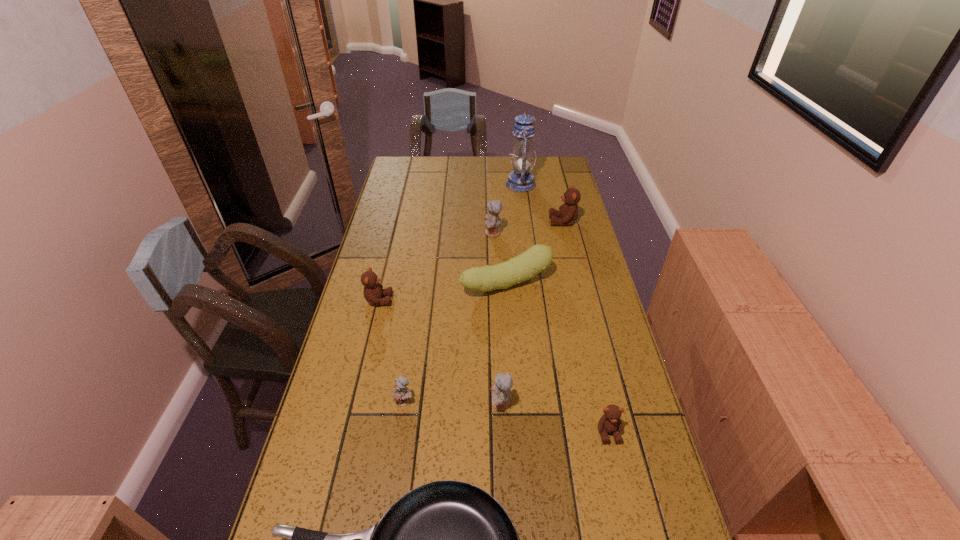
The width and height of the screenshot is (960, 540). I want to click on free location located on the face of the farthest brown teddy bear, so click(519, 221).

Where is `free space located 0.390m on the front of the cucumber`? free space located 0.390m on the front of the cucumber is located at coordinates (515, 408).

Locate an element on the screen. This screenshot has height=540, width=960. vacant space located on the face of the leftmost teddy bear is located at coordinates (422, 300).

You are a GUI agent. You are given a task and a screenshot of the screen. Output one action in this format:
    pyautogui.click(x=<x>, y=<y>)
    Task: Click on the free space located 0.180m on the front-facing side of the second biggest blue teddy bear
    The image size is (960, 540).
    Given the screenshot: What is the action you would take?
    pyautogui.click(x=422, y=403)

Where is `free space located 0.280m on the front-facing side of the second biggest blue teddy bear`? Image resolution: width=960 pixels, height=540 pixels. free space located 0.280m on the front-facing side of the second biggest blue teddy bear is located at coordinates (384, 403).

Locate an element on the screen. The width and height of the screenshot is (960, 540). free space located 0.350m on the front-facing side of the second biggest blue teddy bear is located at coordinates (357, 403).

The width and height of the screenshot is (960, 540). I want to click on vacant area situated 0.210m on the front-facing side of the leftmost blue teddy bear, so click(x=392, y=490).

What are the coordinates of `vacant space located on the face of the smallest brown teddy bear` in the screenshot? It's located at (624, 501).

This screenshot has height=540, width=960. In order to click on object situated at the far edge in this screenshot , I will do tap(521, 179).

What are the coordinates of `object located at the left edge` in the screenshot? It's located at (373, 291).